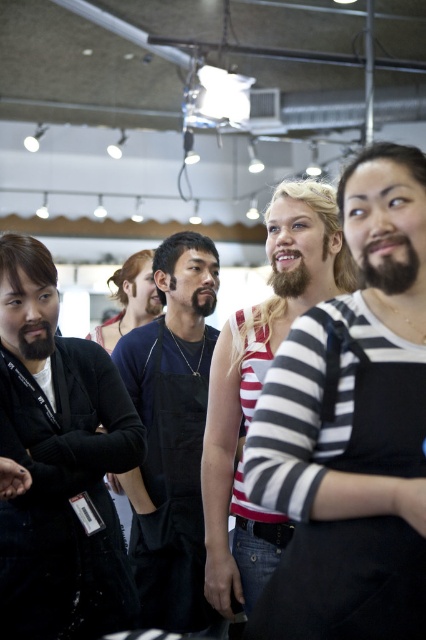
You are standing in the middle of the large hall and see the black matte apron at center and the blondehairbeard at center. Which one is closer to you?

The black matte apron at center is closer to you because it is further to the viewer than the blondehairbeard at center.

You are a photographer standing at the back of the hall. You want to take a photo of both the black matte jacket at left and blondehairbeard at center without any obstruction. Given that your camera has a maximum focus range of 45 centimeters, will you be able to capture both subjects in focus?

The black matte jacket at left and blondehairbeard at center are 44.75 centimeters apart from each other, which is within the camera maximum focus range of 45 centimeters. Therefore, you can capture both subjects in focus.